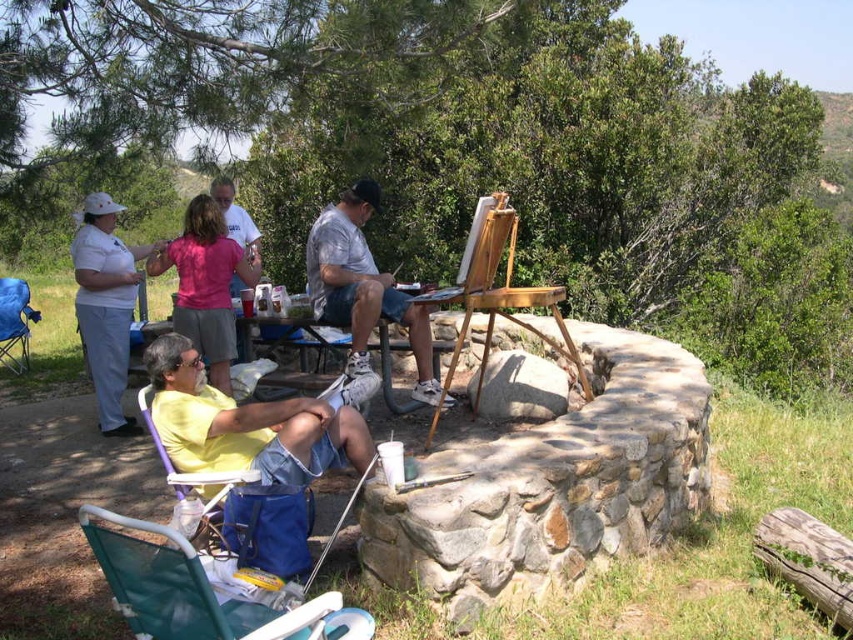
Question: Can you confirm if matte gray shirt at center is smaller than wooden easel at center?

Choices:
 (A) no
 (B) yes

Answer: (B)

Question: Which object is the farthest from the matte gray shirt at center?

Choices:
 (A) green fabric folding chair at lower left
 (B) blue fabric chair at lower left
 (C) wooden easel at center
 (D) purple plastic chair at lower left

Answer: (B)

Question: Which point is closer to the camera?

Choices:
 (A) (209, 506)
 (B) (521, 323)
 (C) (20, 296)

Answer: (A)

Question: Which point is farther from the camera taking this photo?

Choices:
 (A) (560, 348)
 (B) (175, 506)

Answer: (A)

Question: Is green fabric folding chair at lower left to the left of wooden easel at center from the viewer's perspective?

Choices:
 (A) no
 (B) yes

Answer: (B)

Question: Does green fabric folding chair at lower left lie in front of blue fabric chair at lower left?

Choices:
 (A) yes
 (B) no

Answer: (A)